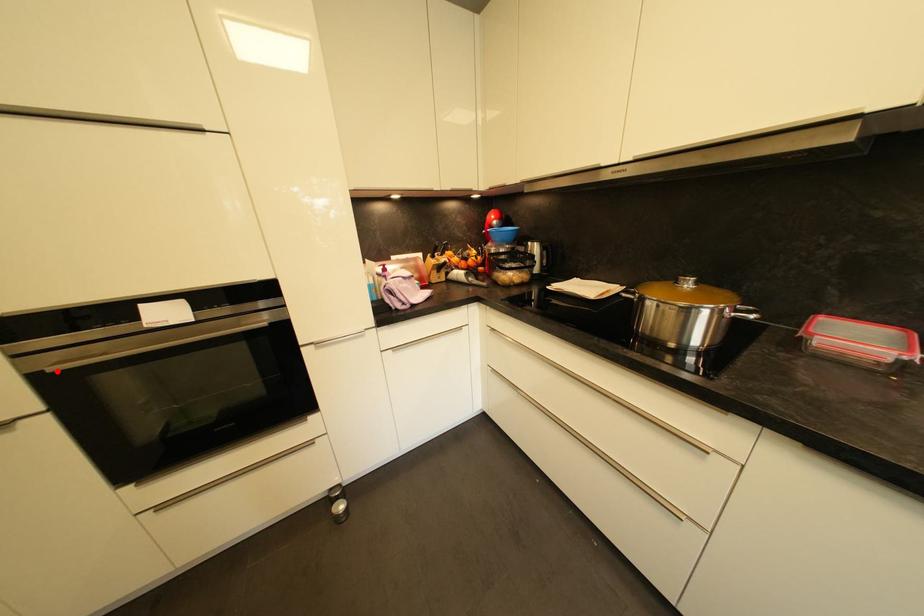
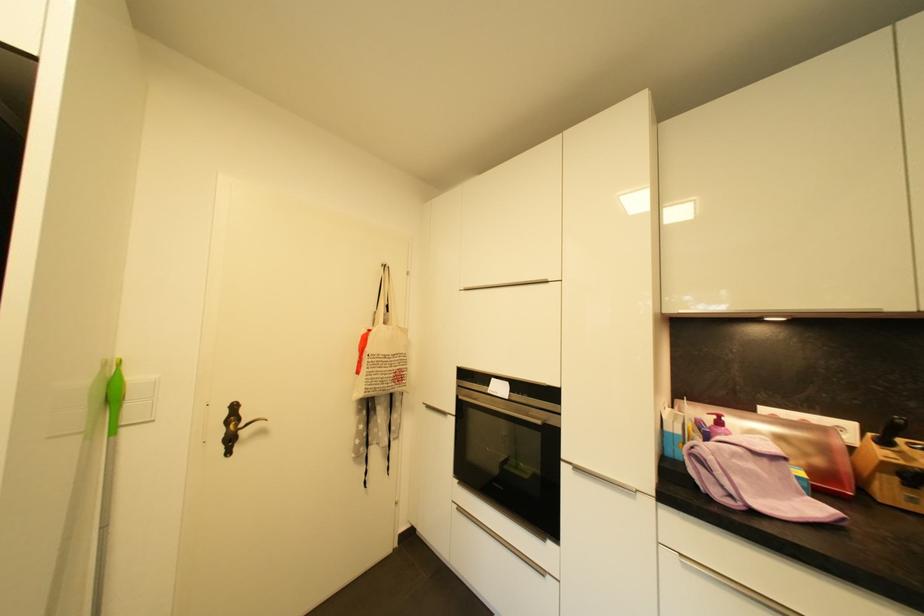
Locate, in the second image, the point that corresponds to the highlighted location in the first image.

(466, 399)